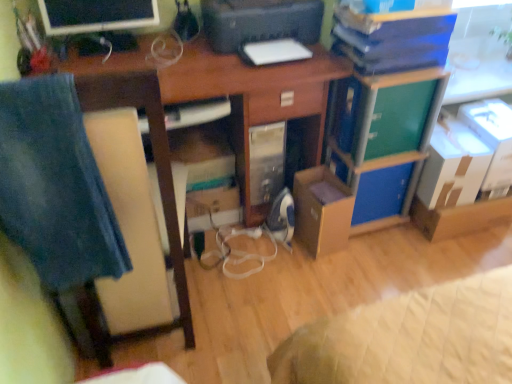
Locate an element on the screen. Image resolution: width=512 pixels, height=384 pixels. vacant area that lies in front of matte black monitor at upper left is located at coordinates (111, 59).